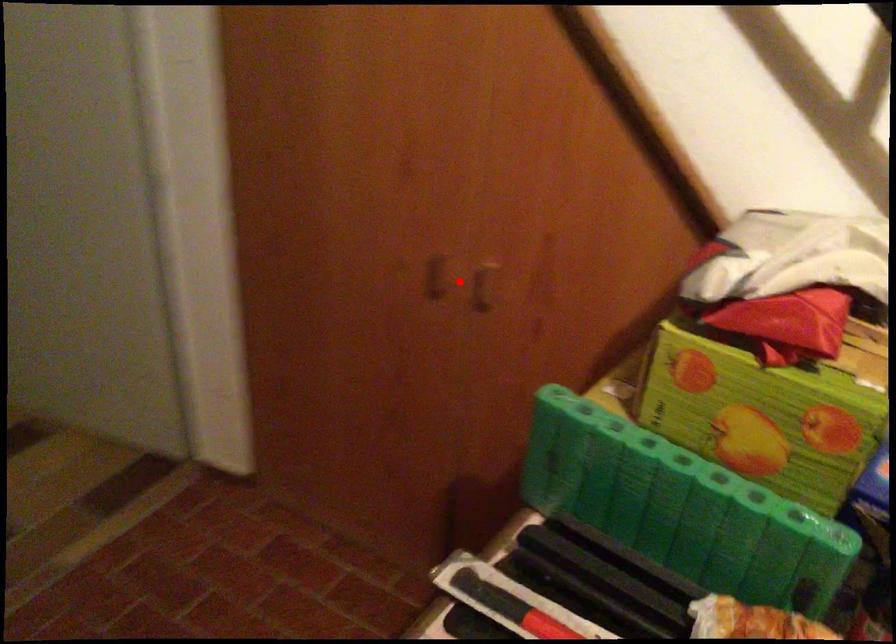
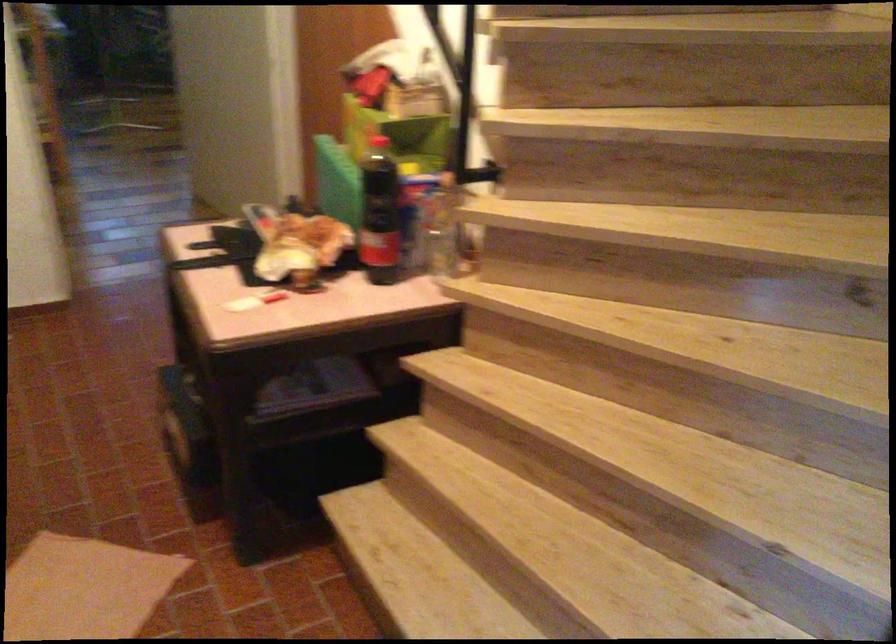
Question: I am providing you with two images of the same scene from different viewpoints. A red point is marked on the first image. Can you still see the location of the red point in image 2?

Choices:
 (A) Yes
 (B) No

Answer: (B)